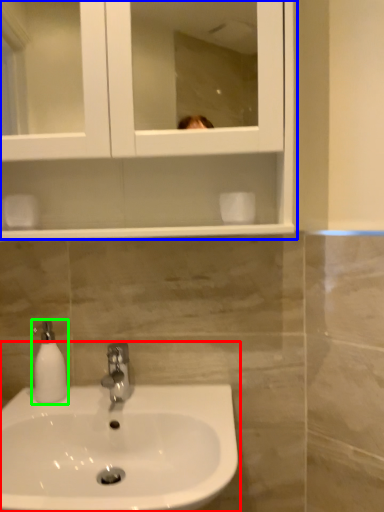
Question: Estimate the real-world distances between objects in this image. Which object is closer to sink (highlighted by a red box), medicine cabinet (highlighted by a blue box) or soap dispenser (highlighted by a green box)?

Choices:
 (A) medicine cabinet
 (B) soap dispenser

Answer: (B)